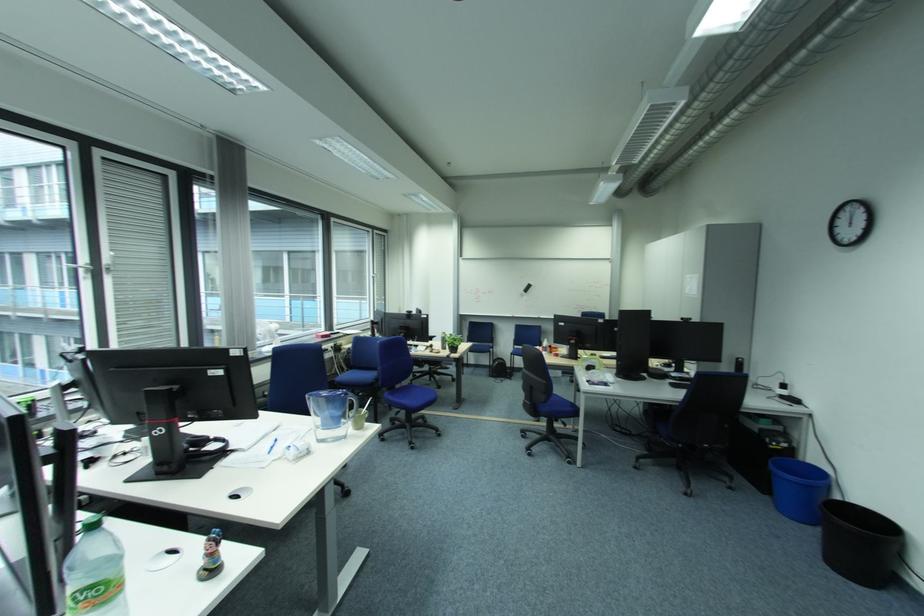
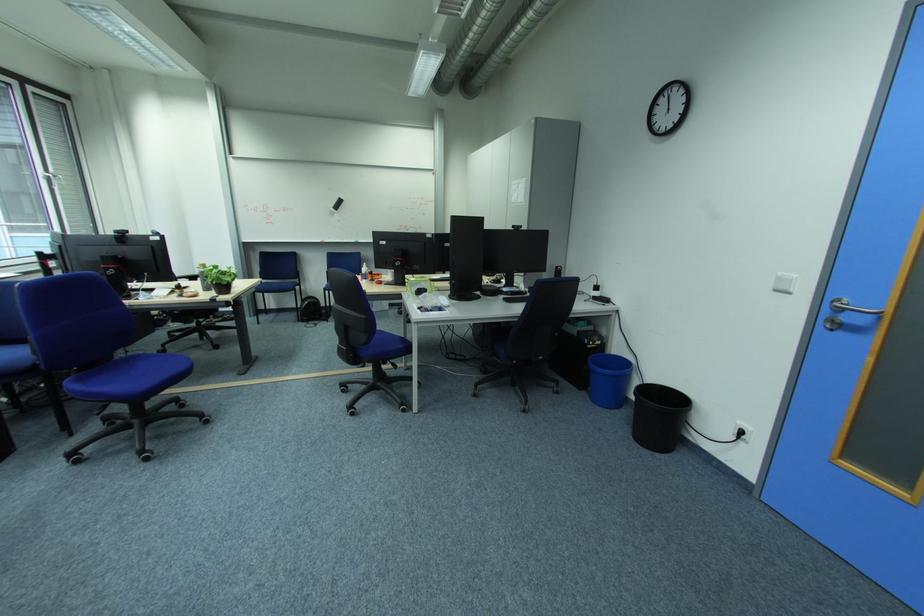
Find the pixel in the second image that matches point (829, 557) in the first image.

(640, 439)